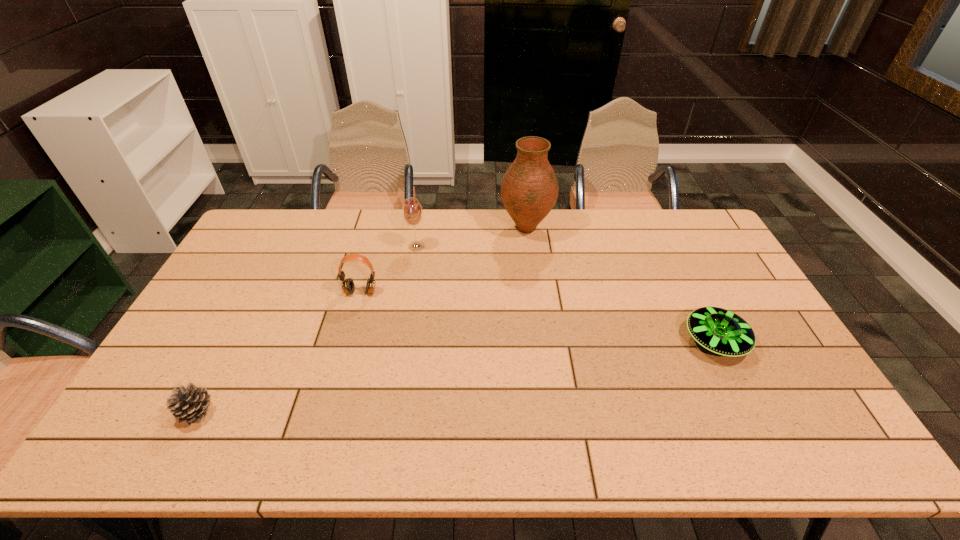
Identify the location of vacant region that satisfies the following two spatial constraints: 1. on the ear cups of the third tallest object; 2. on the left side of the saucer. (348, 341).